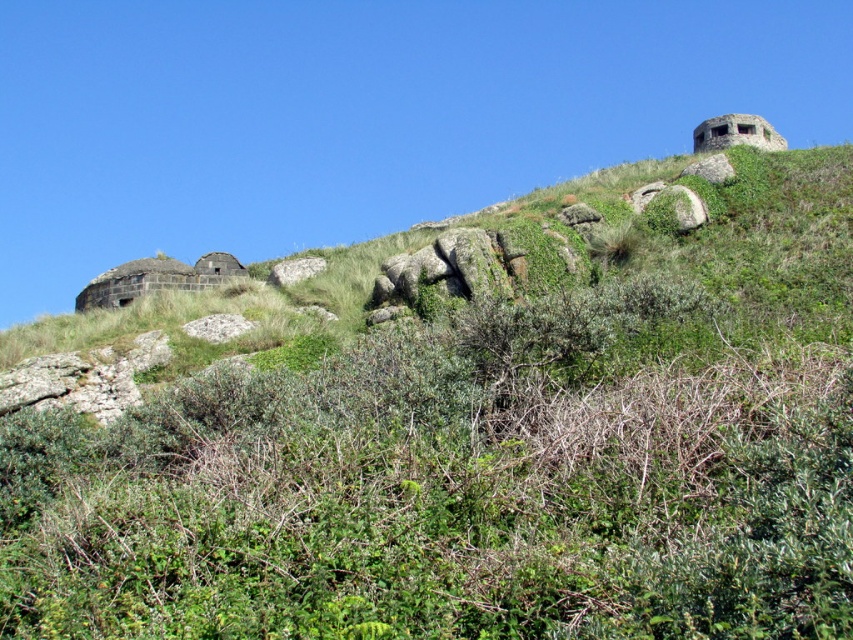
You are a hiker who wants to take a photo of the rustic stone fort at upper left and the green leafy shrubs at upper center. Which object should you position to your left side to frame both in the camera view?

To frame both the rustic stone fort at upper left and the green leafy shrubs at upper center in your camera view, position the rustic stone fort at upper left to your left side since the green leafy shrubs at upper center are located to the right of it.